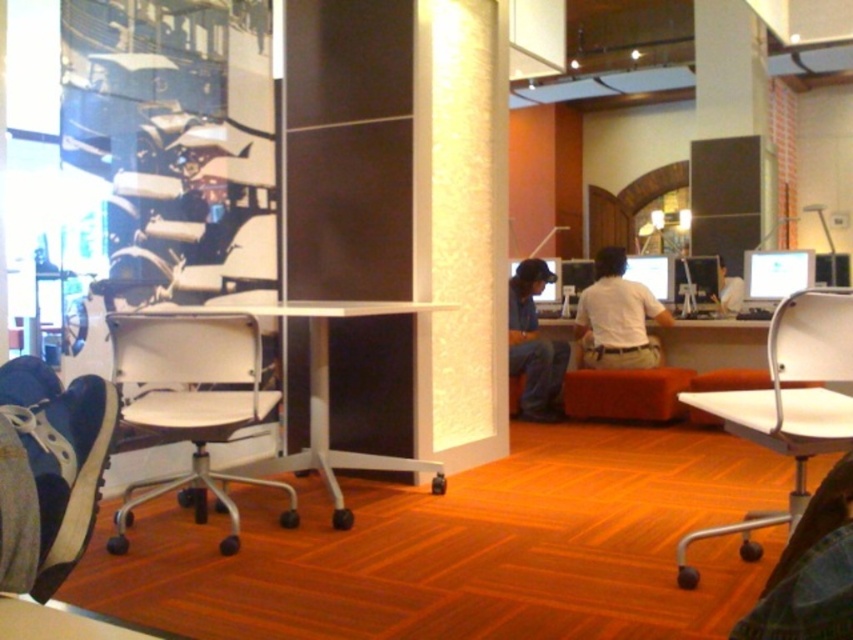
Is point (618, 344) farther from camera compared to point (726, 301)?

That is False.

Between point (584, 355) and point (718, 284), which one is positioned behind?

Point (718, 284)

Describe the element at coordinates (618, 317) in the screenshot. The width and height of the screenshot is (853, 640). I see `white cotton shirt at center` at that location.

The height and width of the screenshot is (640, 853). Find the location of `white cotton shirt at center`. white cotton shirt at center is located at coordinates (618, 317).

Can you confirm if white plastic swivel chair at left is thinner than white plastic table at center?

Correct, white plastic swivel chair at left's width is less than white plastic table at center's.

Does point (120, 412) come behind point (318, 340)?

No, (120, 412) is closer to viewer.

This screenshot has height=640, width=853. Describe the element at coordinates (190, 404) in the screenshot. I see `white plastic swivel chair at left` at that location.

This screenshot has height=640, width=853. In order to click on white plastic swivel chair at left in this screenshot , I will do `click(190, 404)`.

Which is above, white plastic swivel chair at left or denim jeans at center?

Positioned higher is denim jeans at center.

Does white plastic swivel chair at left have a lesser width compared to denim jeans at center?

No.

This screenshot has width=853, height=640. What do you see at coordinates (190, 404) in the screenshot?
I see `white plastic swivel chair at left` at bounding box center [190, 404].

Locate an element on the screen. This screenshot has height=640, width=853. white plastic swivel chair at left is located at coordinates (190, 404).